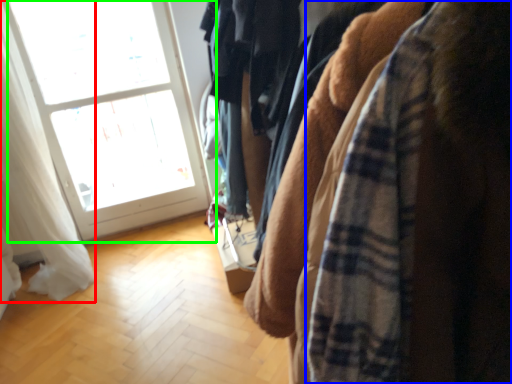
Question: Estimate the real-world distances between objects in this image. Which object is farther from curtain (highlighted by a red box), flannel (highlighted by a blue box) or window (highlighted by a green box)?

Choices:
 (A) flannel
 (B) window

Answer: (A)